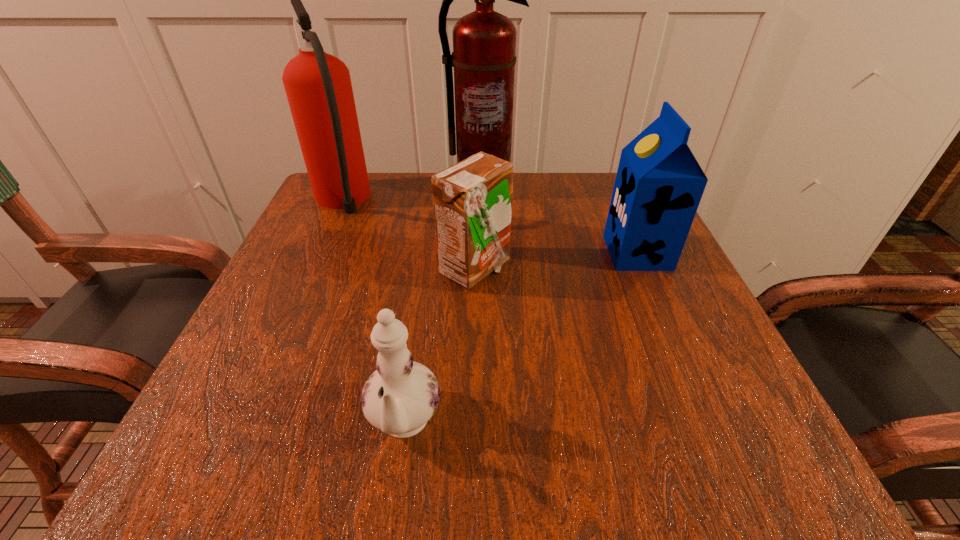
The width and height of the screenshot is (960, 540). Find the location of `free space in the image that satisfies the following two spatial constraints: 1. on the straw side of the shorter carton; 2. at the spout of the nearest object`. free space in the image that satisfies the following two spatial constraints: 1. on the straw side of the shorter carton; 2. at the spout of the nearest object is located at coordinates (472, 426).

Find the location of a particular element. The width and height of the screenshot is (960, 540). vacant area that satisfies the following two spatial constraints: 1. on the side of the right fire extinguisher with the handle and hose; 2. on the straw side of the left carton is located at coordinates (483, 269).

Locate an element on the screen. The image size is (960, 540). free spot that satisfies the following two spatial constraints: 1. on the straw side of the shorter carton; 2. at the spout of the nearest object is located at coordinates (472, 426).

This screenshot has height=540, width=960. Find the location of `free space that satisfies the following two spatial constraints: 1. on the straw side of the shorter carton; 2. at the spout of the nearest object`. free space that satisfies the following two spatial constraints: 1. on the straw side of the shorter carton; 2. at the spout of the nearest object is located at coordinates (472, 426).

Find the location of `free spot that satisfies the following two spatial constraints: 1. on the side of the right fire extinguisher with the handle and hose; 2. on the straw side of the shorter carton`. free spot that satisfies the following two spatial constraints: 1. on the side of the right fire extinguisher with the handle and hose; 2. on the straw side of the shorter carton is located at coordinates 483,269.